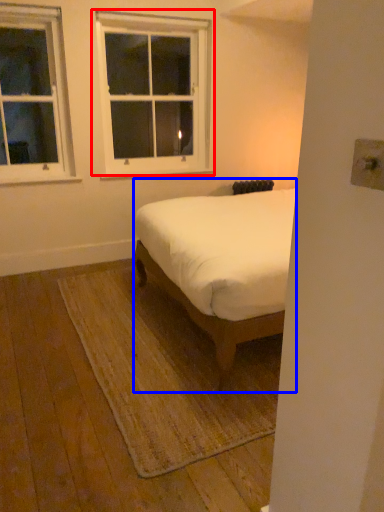
Question: Among these objects, which one is farthest to the camera, window (highlighted by a red box) or bed (highlighted by a blue box)?

Choices:
 (A) window
 (B) bed

Answer: (A)